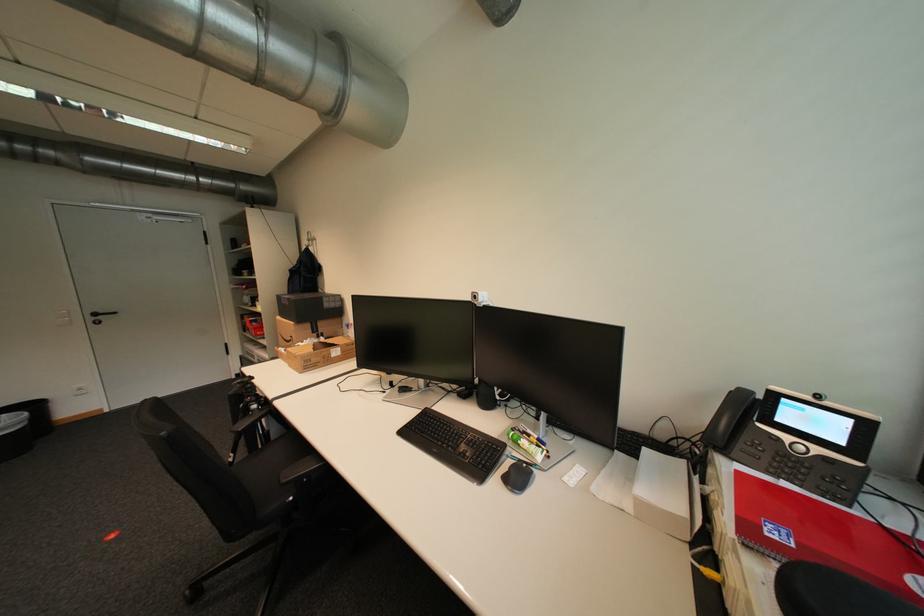
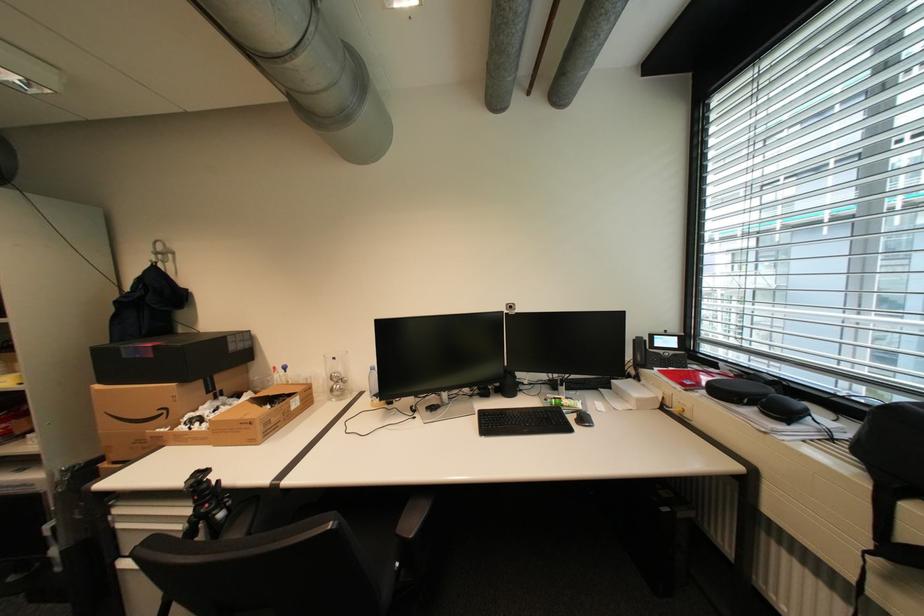
Locate, in the second image, the point that corresponds to pixel 514 467 in the first image.

(579, 419)